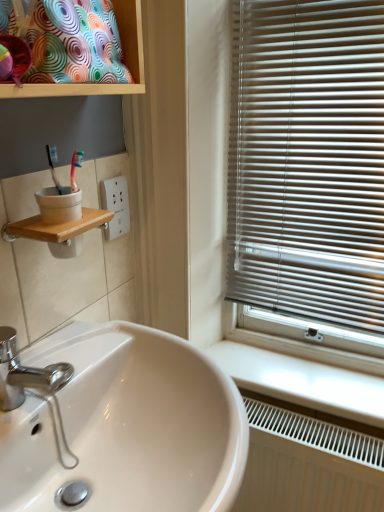
This screenshot has height=512, width=384. In order to click on blank space situated above white glossy counter top at lower right (from a real-world perspective) in this screenshot , I will do `click(284, 369)`.